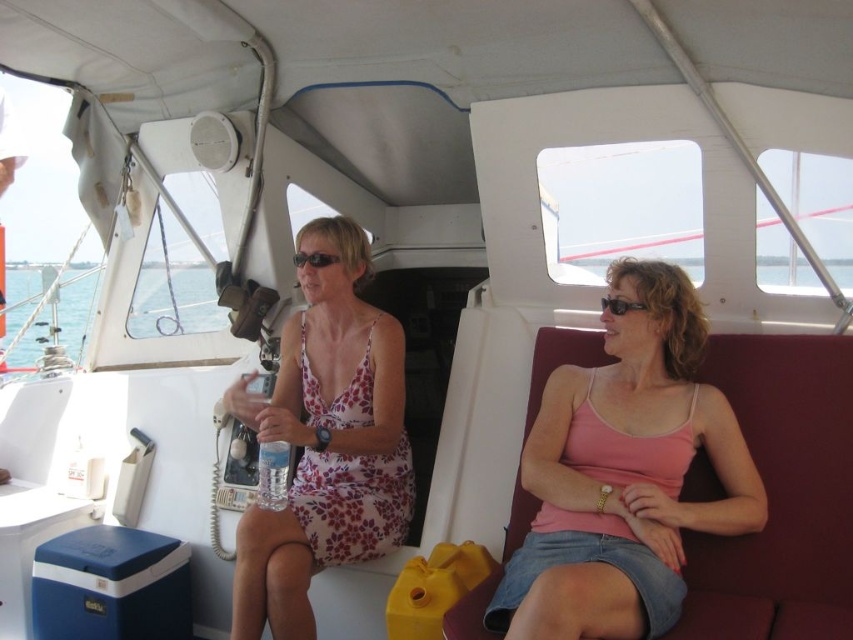
Who is positioned more to the left, pink fabric tank top at center or floral fabric dress at center?

floral fabric dress at center

Is point (555, 369) positioned in front of point (318, 234)?

Yes, point (555, 369) is in front of point (318, 234).

Between point (496, 621) and point (338, 456), which one is positioned behind?

Point (338, 456)

Locate an element on the screen. This screenshot has height=640, width=853. pink fabric tank top at center is located at coordinates (624, 474).

Is pink fabric tank top at center wider than black plastic goggles at center?

Correct, the width of pink fabric tank top at center exceeds that of black plastic goggles at center.

Is pink fabric tank top at center to the left of black plastic goggles at center from the viewer's perspective?

Incorrect, pink fabric tank top at center is not on the left side of black plastic goggles at center.

Where is `pink fabric tank top at center`? The image size is (853, 640). pink fabric tank top at center is located at coordinates (624, 474).

Between black plastic sunglasses at center and black plastic goggles at center, which one has less height?

black plastic sunglasses at center

Who is more forward, (322,262) or (610,307)?

Point (610,307) is more forward.

The image size is (853, 640). Identify the location of black plastic sunglasses at center. (314, 259).